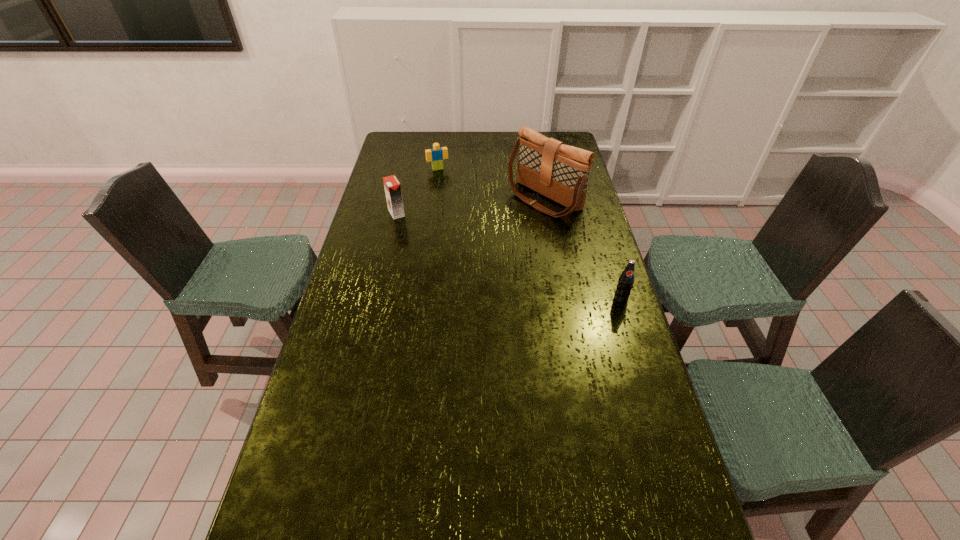
Locate an element on the screen. free space on the desktop that is between the leftmost object and the rightmost object and is positioned on the face of the farthest object is located at coordinates (473, 242).

Locate an element on the screen. vacant spot on the desktop that is between the leftmost object and the rightmost object and is positioned on the front-facing side of the shoulder bag is located at coordinates (474, 243).